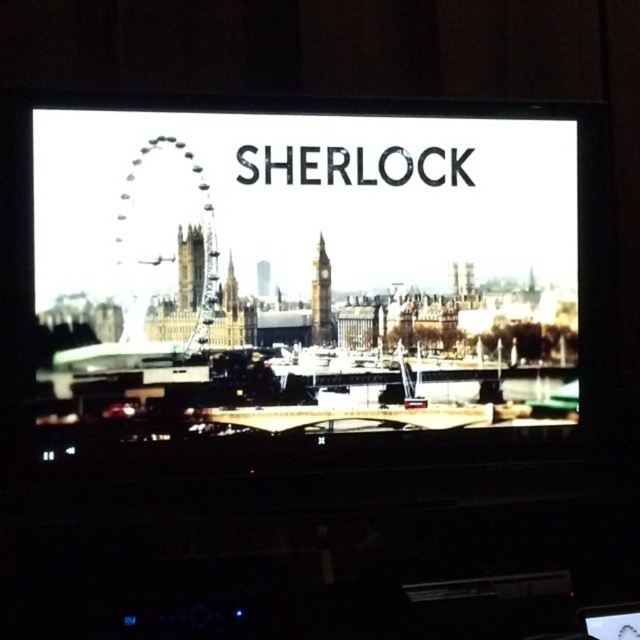
You are standing 1.5 meters away from the TV screen. There is a point at coordinates point (512, 308) on the screen. Can you reach this point with your hand without moving closer to the TV?

The distance of point (512, 308) from viewer is 1.40 meters, so yes, you can reach this point with your hand without moving closer to the TV since you are standing 1.5 meters away, which is slightly further than the point itself.

You are a photographer trying to capture the entire scene of the title card for the show Sherlock. You notice the matte black screen at center and the stone clock tower at center. Which object would you need to adjust your camera angle to fully capture in your photo?

The matte black screen at center is much taller than the stone clock tower at center, so you would need to adjust your camera angle to fully capture the matte black screen at center in your photo.